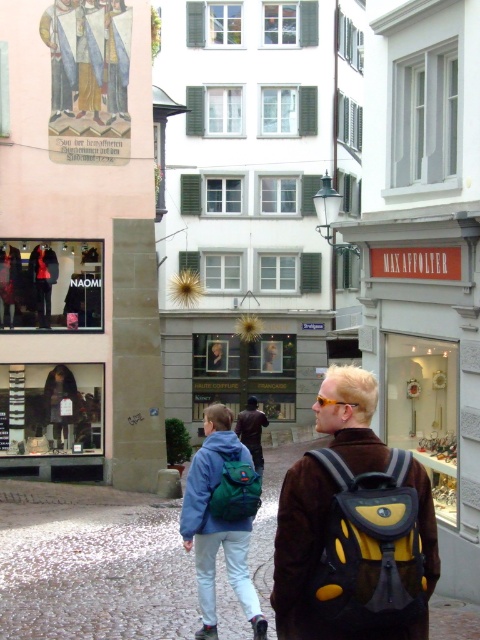
At what (x,y) coordinates should I click in order to perform the action: click on yellow fabric backpack at center. Please return your answer as a coordinate pair (x, y). Looking at the image, I should click on (370, 548).

Is point (377, 614) less distant than point (262, 449)?

Yes.

Is yellow fabric backpack at center below dark brown leather jacket at center?

Incorrect, yellow fabric backpack at center is not positioned below dark brown leather jacket at center.

Identify the location of yellow fabric backpack at center. This screenshot has height=640, width=480. (370, 548).

Can you confirm if green fabric backpack at center is taller than dark brown leather jacket at center?

In fact, green fabric backpack at center may be shorter than dark brown leather jacket at center.

Does point (251, 467) lie in front of point (263, 413)?

Yes, it is in front of point (263, 413).

Find the location of `green fabric backpack at center`. green fabric backpack at center is located at coordinates (235, 490).